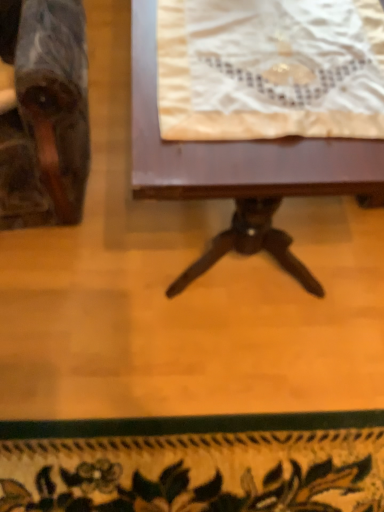
The width and height of the screenshot is (384, 512). Describe the element at coordinates (44, 113) in the screenshot. I see `marble-like wooden chair at left` at that location.

Where is `white lace cloth at upper center`? The height and width of the screenshot is (512, 384). white lace cloth at upper center is located at coordinates (270, 69).

From a real-world perspective, is marble-like wooden chair at left above or below white lace cloth at upper center?

marble-like wooden chair at left is situated lower than white lace cloth at upper center in the real world.

Considering their positions, is marble-like wooden chair at left located in front of or behind white lace cloth at upper center?

marble-like wooden chair at left is in front of white lace cloth at upper center.

Would you say marble-like wooden chair at left is outside white lace cloth at upper center?

marble-like wooden chair at left is positioned outside white lace cloth at upper center.

Consider the image. From the image's perspective, is marble-like wooden chair at left located beneath white lace cloth at upper center?

No, from the image's perspective, marble-like wooden chair at left is not below white lace cloth at upper center.

Is wooden table at center turned away from marble-like wooden chair at left?

That's not correct — wooden table at center is not looking away from marble-like wooden chair at left.

Between point (259, 202) and point (73, 24), which one is positioned behind?

The point (73, 24) is farther.

Is wooden table at center further to the viewer compared to marble-like wooden chair at left?

Yes, the depth of wooden table at center is greater than that of marble-like wooden chair at left.

Which object is positioned more to the left, wooden table at center or marble-like wooden chair at left?

Positioned to the left is marble-like wooden chair at left.

Does point (43, 202) come farther from viewer compared to point (186, 170)?

Yes.

Which is more to the right, marble-like wooden chair at left or wooden table at center?

From the viewer's perspective, wooden table at center appears more on the right side.

Which is behind, point (359, 111) or point (161, 177)?

Point (359, 111)

The image size is (384, 512). In the image, there is a wooden table at center. Identify the location of blanket below it (from the image's perspective). (270, 69).

Who is shorter, white lace cloth at upper center or wooden table at center?

white lace cloth at upper center is shorter.

Between white lace cloth at upper center and wooden table at center, which one has smaller size?

Smaller between the two is white lace cloth at upper center.

Can you confirm if wooden table at center is bigger than white lace cloth at upper center?

Yes.

From the image's perspective, who appears lower, wooden table at center or white lace cloth at upper center?

white lace cloth at upper center appears lower in the image.

Which is in front, point (339, 143) or point (213, 94)?

The point (339, 143) is closer.

Which of these two, wooden table at center or white lace cloth at upper center, stands shorter?

white lace cloth at upper center.

Considering the sizes of objects white lace cloth at upper center and marble-like wooden chair at left in the image provided, who is smaller, white lace cloth at upper center or marble-like wooden chair at left?

white lace cloth at upper center is smaller.

Is white lace cloth at upper center not near marble-like wooden chair at left?

white lace cloth at upper center is near marble-like wooden chair at left, not far away.

Where is `chair lying on the left of white lace cloth at upper center`? chair lying on the left of white lace cloth at upper center is located at coordinates (44, 113).

What are the coordinates of `chair lying on the left of white lace cloth at upper center` in the screenshot? It's located at (44, 113).

Identify the location of table on the right of the marble-like wooden chair at left. The height and width of the screenshot is (512, 384). (239, 170).

From the image, which object appears to be nearer to wooden table at center, marble-like wooden chair at left or white lace cloth at upper center?

Among the two, white lace cloth at upper center is located nearer to wooden table at center.

Which object lies further to the anchor point marble-like wooden chair at left, wooden table at center or white lace cloth at upper center?

white lace cloth at upper center.

Which object lies nearer to the anchor point wooden table at center, white lace cloth at upper center or marble-like wooden chair at left?

The object closer to wooden table at center is white lace cloth at upper center.

Looking at the image, which one is located closer to white lace cloth at upper center, wooden table at center or marble-like wooden chair at left?

Based on the image, wooden table at center appears to be nearer to white lace cloth at upper center.

Looking at this image, which object lies further to the anchor point marble-like wooden chair at left, white lace cloth at upper center or wooden table at center?

white lace cloth at upper center is positioned further to the anchor marble-like wooden chair at left.

When comparing their distances from white lace cloth at upper center, does marble-like wooden chair at left or wooden table at center seem further?

Based on the image, marble-like wooden chair at left appears to be further to white lace cloth at upper center.

Image resolution: width=384 pixels, height=512 pixels. Find the location of `table between marble-like wooden chair at left and white lace cloth at upper center`. table between marble-like wooden chair at left and white lace cloth at upper center is located at coordinates (239, 170).